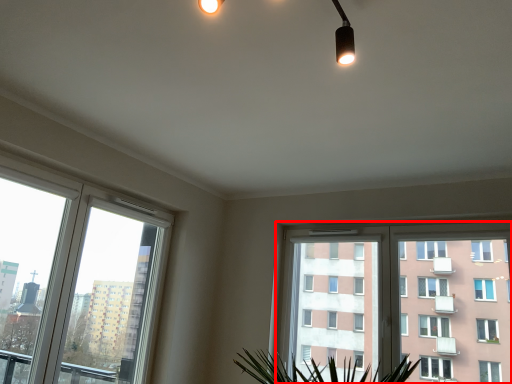
Question: From the image's perspective, where is window (annotated by the red box) located in relation to window in the image?

Choices:
 (A) above
 (B) below

Answer: (B)